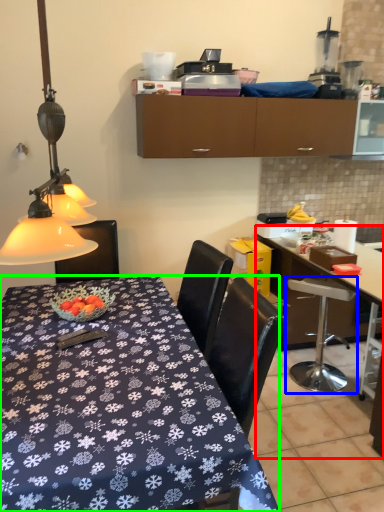
Question: Based on their relative distances, which object is farther from desk (highlighted by a red box)? Choose from chair (highlighted by a blue box) and desk (highlighted by a green box).

Choices:
 (A) chair
 (B) desk

Answer: (B)